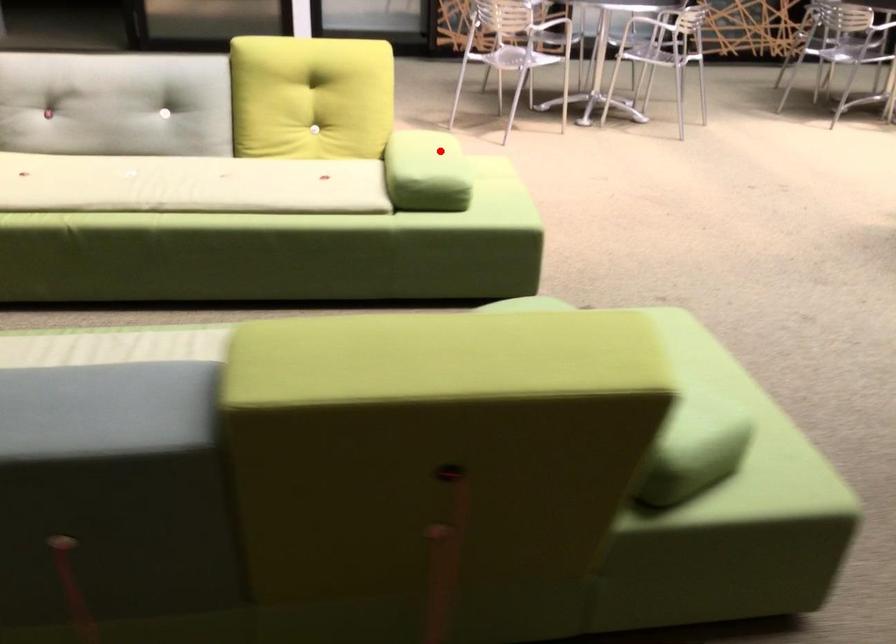
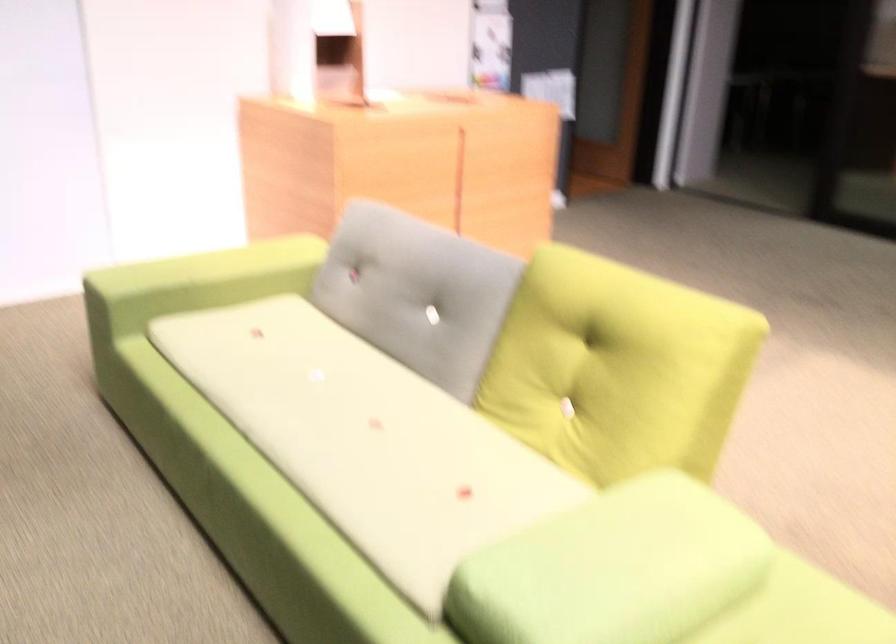
Question: I am providing you with two images of the same scene from different viewpoints. Image1 has a red point marked. In image2, the corresponding 3D location appears at what relative position? Reply with the corresponding letter.

Choices:
 (A) Closer
 (B) Farther

Answer: (A)